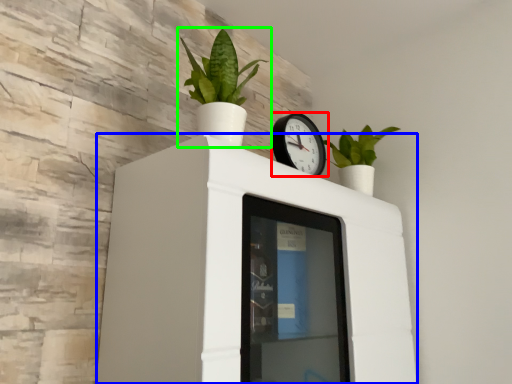
Question: Estimate the real-world distances between objects in this image. Which object is farther from wall clock (highlighted by a red box), furniture (highlighted by a blue box) or houseplant (highlighted by a green box)?

Choices:
 (A) furniture
 (B) houseplant

Answer: (A)